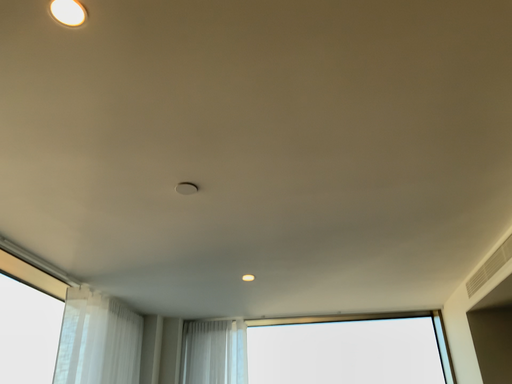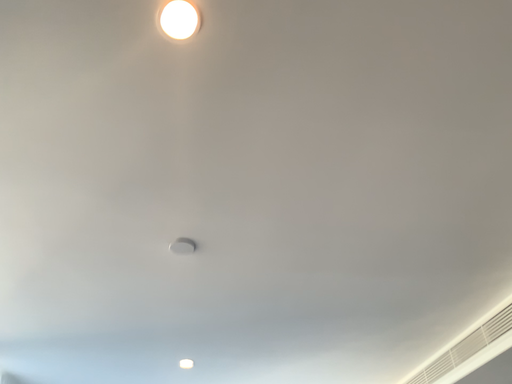
Question: How did the camera likely rotate when shooting the video?

Choices:
 (A) rotated left
 (B) rotated right

Answer: (B)